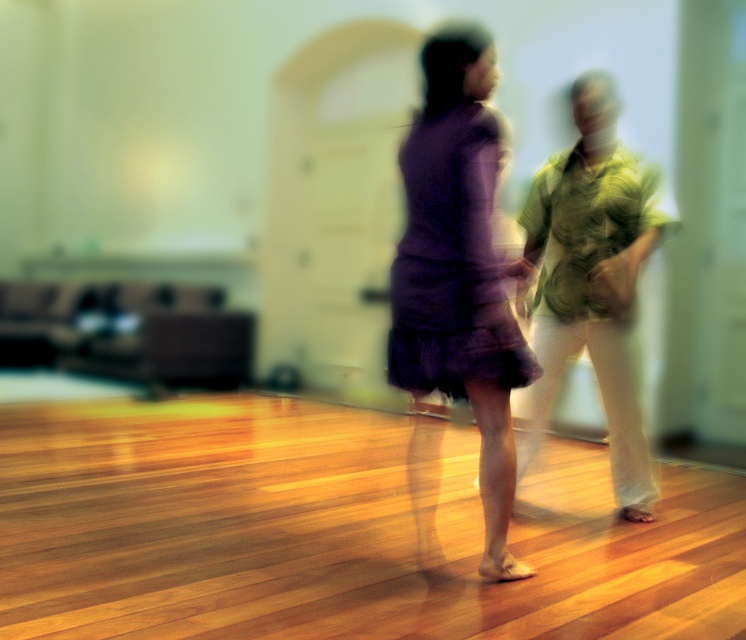
Question: Is purple matte dress at center to the left of green textured shirt at right from the viewer's perspective?

Choices:
 (A) yes
 (B) no

Answer: (A)

Question: Is purple matte dress at center bigger than green textured shirt at right?

Choices:
 (A) yes
 (B) no

Answer: (A)

Question: Does purple matte dress at center appear under green textured shirt at right?

Choices:
 (A) no
 (B) yes

Answer: (B)